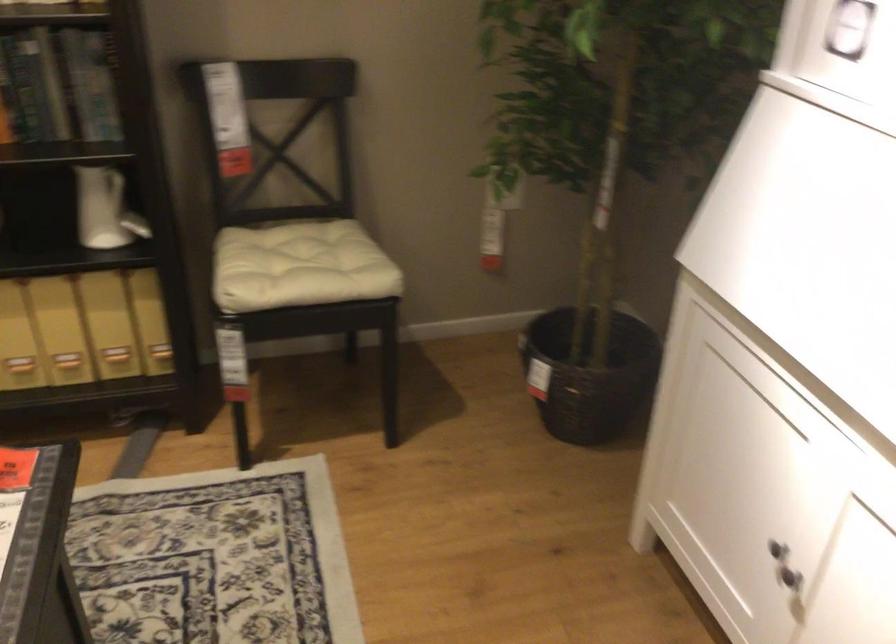
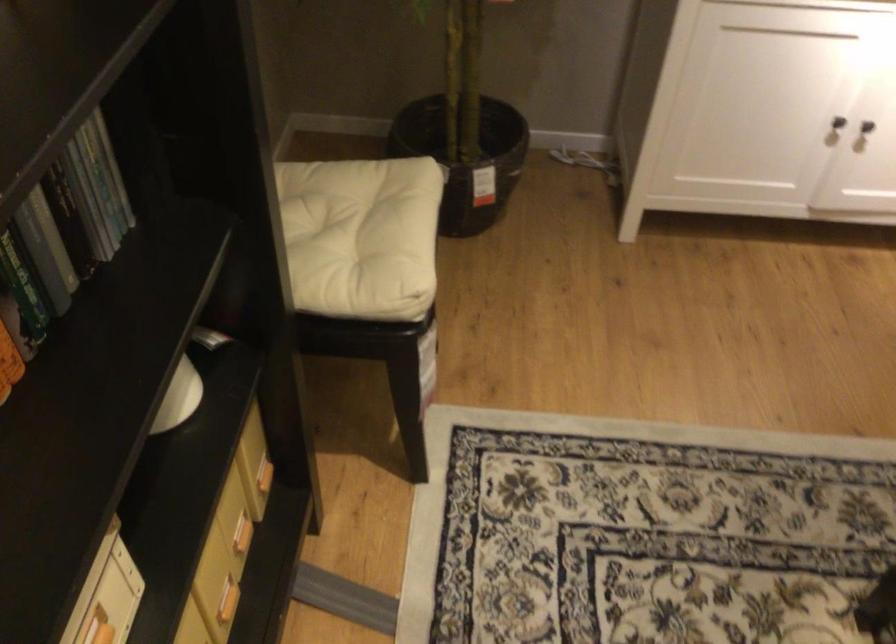
In the second image, find the point that corresponds to (x=119, y=351) in the first image.

(240, 534)